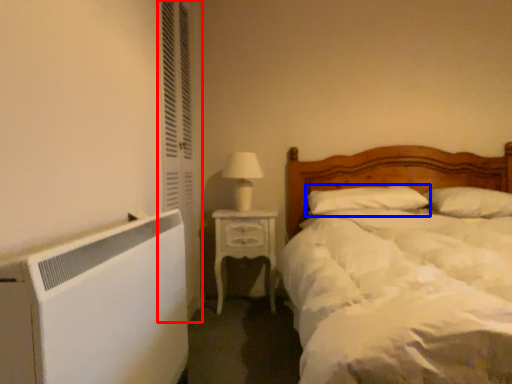
Question: Which of the following is the closest to the observer, screen door (highlighted by a red box) or pillow (highlighted by a blue box)?

Choices:
 (A) screen door
 (B) pillow

Answer: (A)